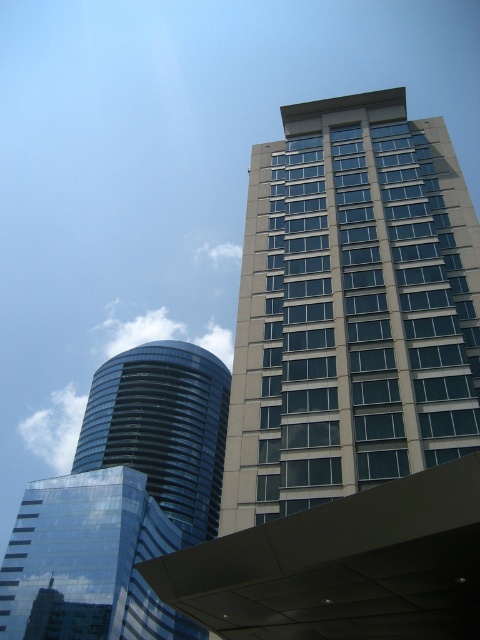
Question: Which point is closer to the camera?

Choices:
 (A) beige glass building at upper right
 (B) glossy glass building at lower left
 (C) shiny glass tower at center left

Answer: (B)

Question: Is glossy glass building at lower left thinner than shiny glass tower at center left?

Choices:
 (A) no
 (B) yes

Answer: (B)

Question: Estimate the real-world distances between objects in this image. Which object is closer to the glossy glass building at lower left?

Choices:
 (A) beige glass building at upper right
 (B) shiny glass tower at center left

Answer: (B)

Question: In this image, where is beige glass building at upper right located relative to glossy glass building at lower left?

Choices:
 (A) above
 (B) below

Answer: (A)

Question: Observing the image, what is the correct spatial positioning of glossy glass building at lower left in reference to shiny glass tower at center left?

Choices:
 (A) right
 (B) left

Answer: (A)

Question: Based on their relative distances, which object is nearer to the shiny glass tower at center left?

Choices:
 (A) glossy glass building at lower left
 (B) beige glass building at upper right

Answer: (A)